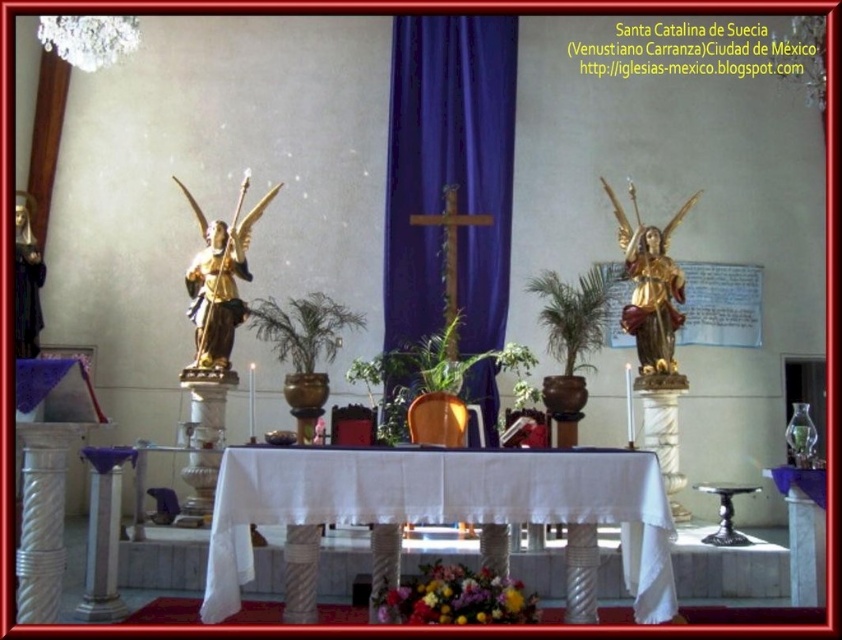
Which is in front, point (216, 260) or point (478, 570)?

Point (478, 570)

Is gold polished statue at left positioned before floral bouquet at lower center?

No, it is behind floral bouquet at lower center.

Measure the distance between gold polished statue at left and camera.

gold polished statue at left and camera are 53.91 feet apart.

At what (x,y) coordinates should I click in order to perform the action: click on gold polished statue at left. Please return your answer as a coordinate pair (x, y). This screenshot has width=842, height=640. Looking at the image, I should click on (219, 280).

Does gold polished statue at center lie in front of gold polished statue at left?

Yes.

From the picture: Does gold polished statue at center have a greater width compared to gold polished statue at left?

Yes, gold polished statue at center is wider than gold polished statue at left.

Identify the location of gold polished statue at center. (649, 285).

Is point (646, 300) closer to camera compared to point (382, 602)?

No, (646, 300) is behind (382, 602).

The height and width of the screenshot is (640, 842). What do you see at coordinates (649, 285) in the screenshot?
I see `gold polished statue at center` at bounding box center [649, 285].

Identify the location of gold polished statue at center. The height and width of the screenshot is (640, 842). (649, 285).